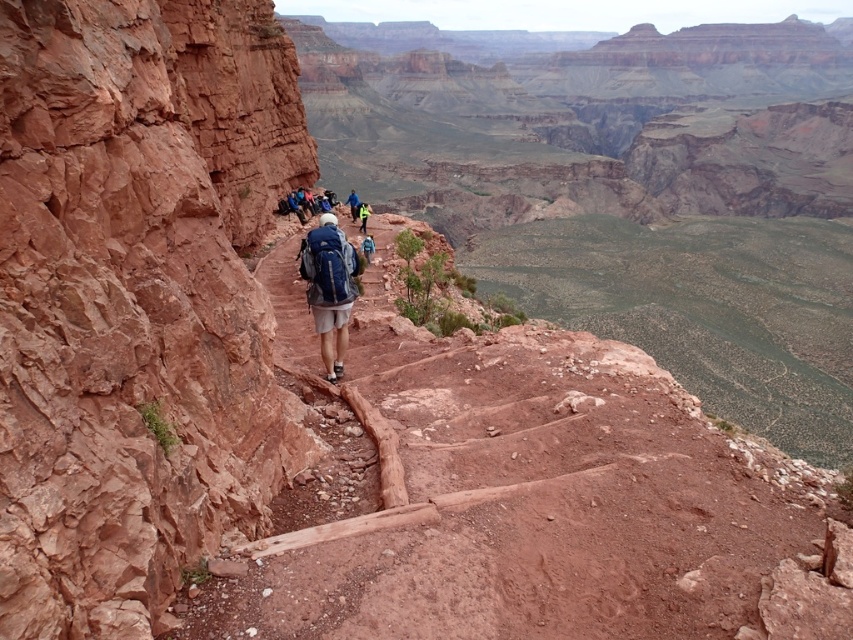
You are standing at the starting point of the Grand Canyon trail and want to reach the first viewpoint. The trail is marked by wooden planks placed at intervals. There is a rustic rock cliff at left near point (136, 298). What direction should you follow to avoid the cliff and stay on the trail?

To avoid the rustic rock cliff at left near point (136, 298) and stay on the trail, you should follow the wooden planks placed along the path, which curves slightly to the right, ensuring you remain on the designated trail.

You are a hiker standing at the starting point of the trail. You see the rustic rock cliff at left represented by point (136,298). Which direction should you walk to move away from the cliff?

The rustic rock cliff at left is represented by point (136,298). To move away from it, you should walk towards the right direction along the trail since the path curves slightly to the right and leads downward away from the cliff.